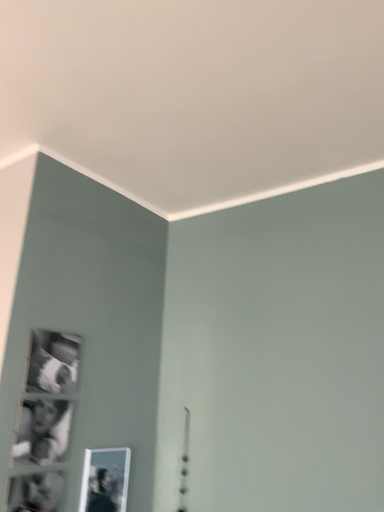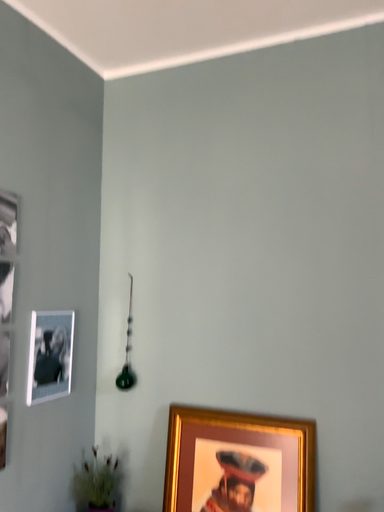
Question: How did the camera likely rotate when shooting the video?

Choices:
 (A) rotated right
 (B) rotated left

Answer: (A)